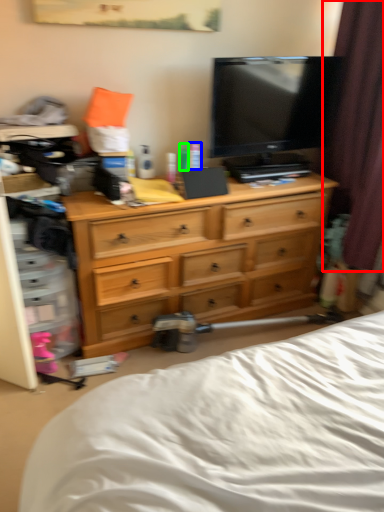
Question: Estimate the real-world distances between objects in this image. Which object is closer to curtain (highlighted by a red box), toiletry (highlighted by a blue box) or toiletry (highlighted by a green box)?

Choices:
 (A) toiletry
 (B) toiletry

Answer: (A)